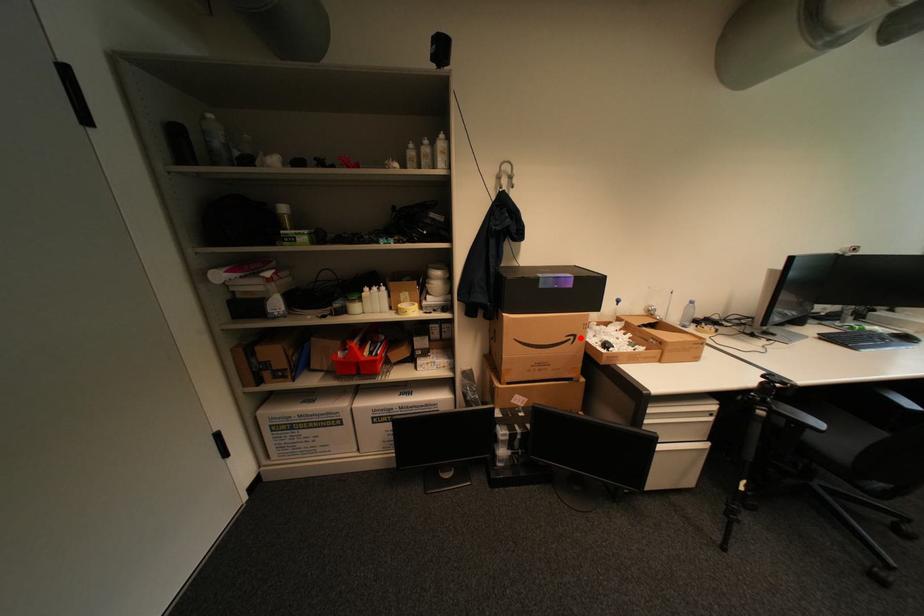
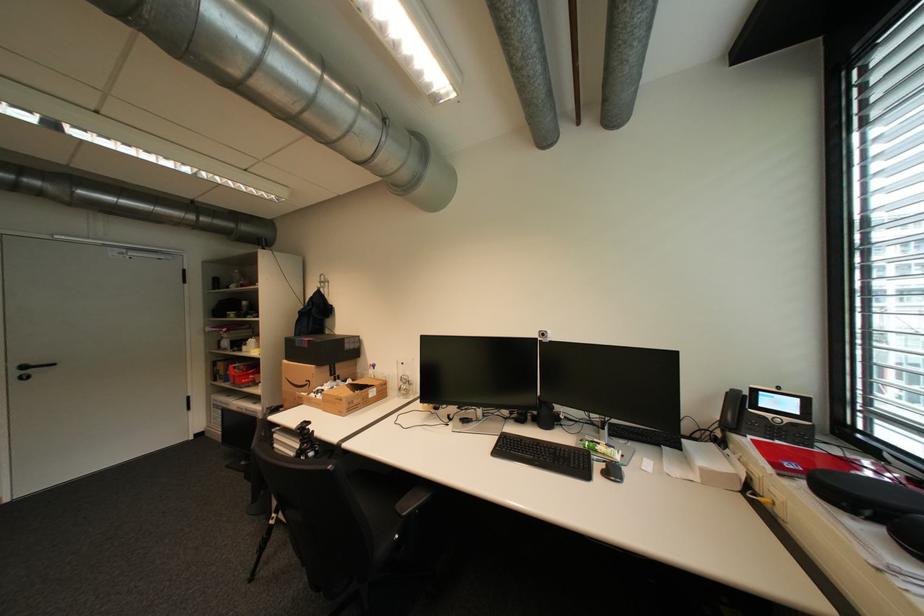
In the second image, find the point that corresponds to the highlighted location in the first image.

(317, 383)